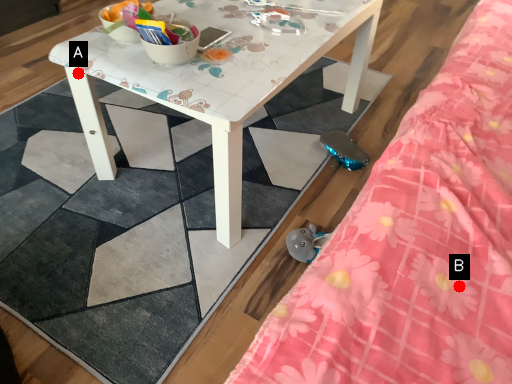
Question: Two points are circled on the image, labeled by A and B beside each circle. Which point appears farthest from the camera in this image?

Choices:
 (A) A is further
 (B) B is further

Answer: (A)